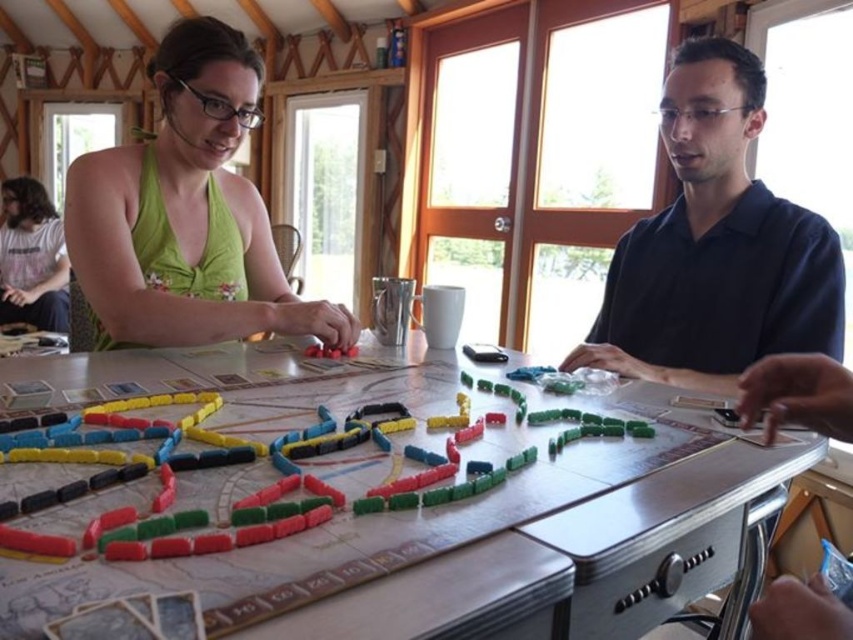
Question: Is the position of green fabric dress at left less distant than that of matte gray t-shirt at lower left?

Choices:
 (A) yes
 (B) no

Answer: (A)

Question: Among these objects, which one is nearest to the camera?

Choices:
 (A) wooden table at center
 (B) matte gray t-shirt at lower left

Answer: (A)

Question: Which object is farther from the camera taking this photo?

Choices:
 (A) matte gray t-shirt at lower left
 (B) green fabric dress at left
 (C) dark blue shirt at right

Answer: (A)

Question: Considering the relative positions of wooden table at center and dark blue shirt at right in the image provided, where is wooden table at center located with respect to dark blue shirt at right?

Choices:
 (A) right
 (B) left

Answer: (B)

Question: Which point is closer to the camera?

Choices:
 (A) green fabric dress at left
 (B) matte gray t-shirt at lower left
 (C) wooden table at center

Answer: (C)

Question: Does green fabric dress at left come in front of matte gray t-shirt at lower left?

Choices:
 (A) yes
 (B) no

Answer: (A)